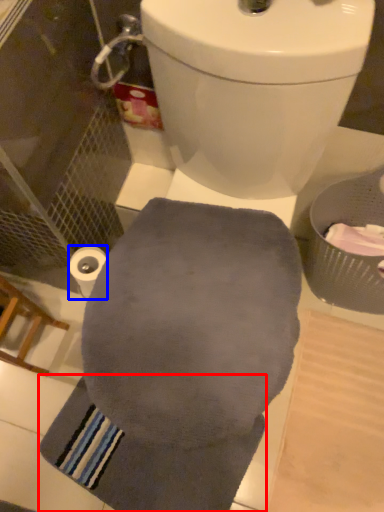
Question: Which object is further to the camera taking this photo, bath towel (highlighted by a red box) or toilet paper (highlighted by a blue box)?

Choices:
 (A) bath towel
 (B) toilet paper

Answer: (A)